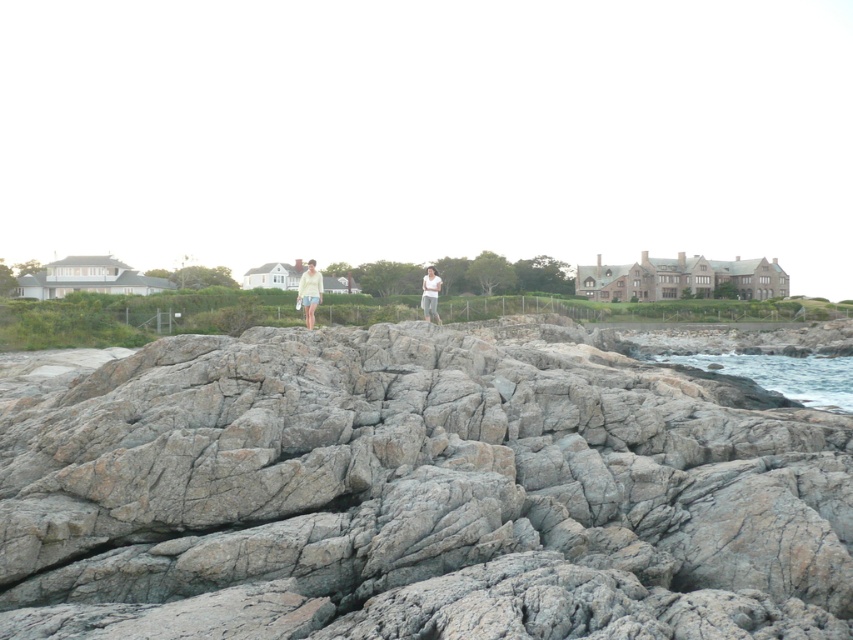
You are standing on the gray rough rock at center and want to reach the blue water at lower right. Which direction should you move to get there?

The gray rough rock at center is to the left of blue water at lower right, so you should move to your right to reach the blue water at lower right.